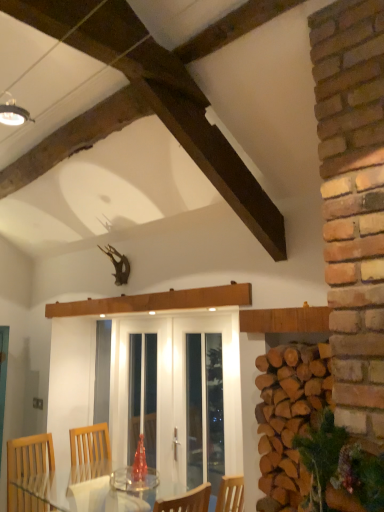
Find the location of a particular element. empty space that is ontop of white glass door at center, the second screen door in the left-to-right sequence (from a real-world perspective) is located at coordinates coord(199,317).